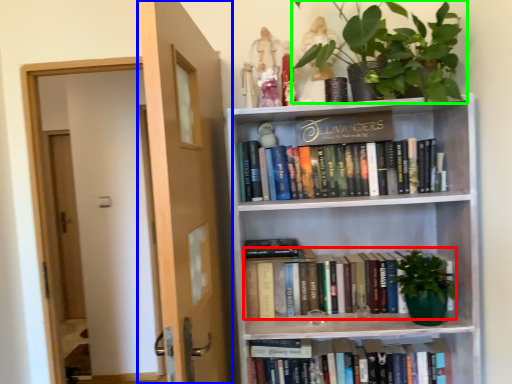
Question: Which object is the closest to the book (highlighted by a red box)? Choose among these: door (highlighted by a blue box) or houseplant (highlighted by a green box).

Choices:
 (A) door
 (B) houseplant

Answer: (A)